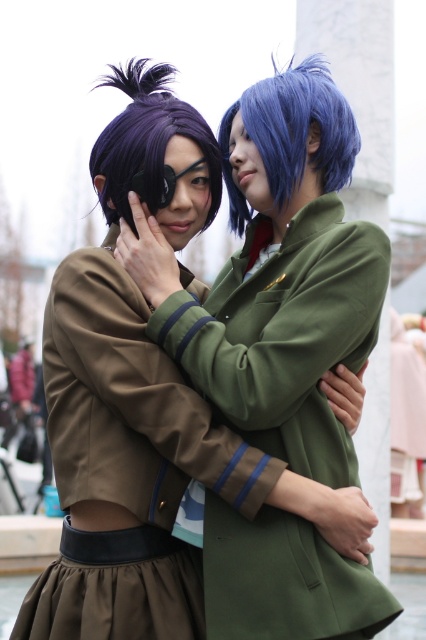
You are a costume designer who needs to ensure that the olive green fabric uniform at center and the blue matte wig at center fit properly. Based on the image, which object is larger in size?

The olive green fabric uniform at center is bigger than the blue matte wig at center, so the olive green fabric uniform at center is larger in size.

You are a photographer trying to capture the perfect shot of the two cosplayers. You want to focus on the olive green fabric uniform at center located at point [284,336]. Which of the two cosplayers should you aim your camera at?

The olive green fabric uniform at center is located at point [284,336], so you should aim your camera at the individual on the right, who is wearing the green military style jacket with gold buttons and a red scarf.

You are a photographer at a cosplay event. You need to decide if the olive green fabric uniform at center and the purple matte wig at left can fit side by side in a photo frame that is 1.2 meters wide. Based on their widths, will they fit?

The olive green fabric uniform at center is wider than the purple matte wig at left. However, since the total width of both objects combined is not provided, it is impossible to determine if they will fit within the 1.2 meter frame.